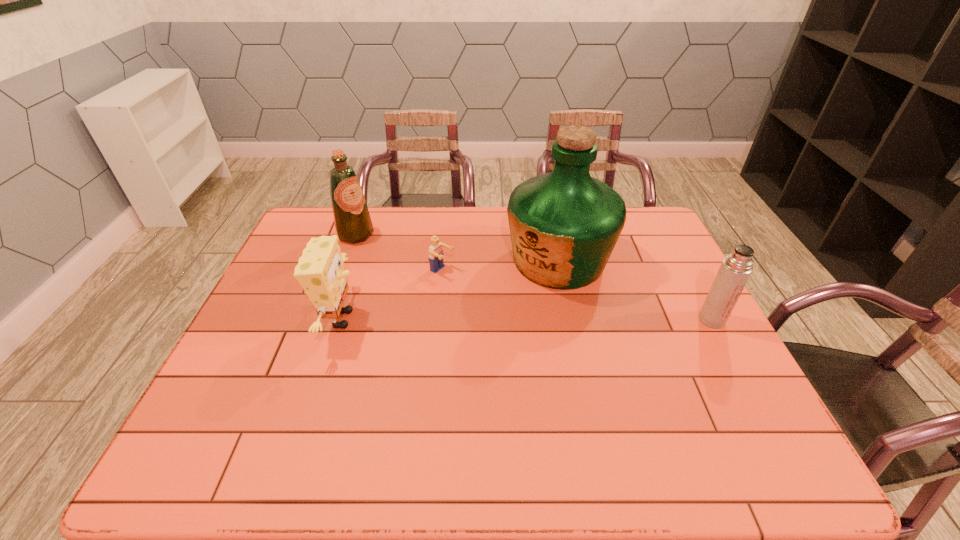
Locate an element on the screen. The image size is (960, 540). object that is at the left edge is located at coordinates (353, 224).

Image resolution: width=960 pixels, height=540 pixels. Find the location of `object at the right edge`. object at the right edge is located at coordinates (735, 270).

Where is `object that is at the far left corner`? object that is at the far left corner is located at coordinates (353, 224).

In the image, there is a desktop. Find the location of `vacant space at the far edge`. vacant space at the far edge is located at coordinates (462, 212).

Image resolution: width=960 pixels, height=540 pixels. Identify the location of vacant space at the near edge of the desktop. (606, 402).

At what (x,y) coordinates should I click in order to perform the action: click on free region at the left edge of the desktop. Please return your answer as a coordinate pair (x, y). Looking at the image, I should click on (249, 332).

Where is `blank space at the right edge of the desktop`? This screenshot has height=540, width=960. blank space at the right edge of the desktop is located at coordinates (703, 357).

Where is `free region at the near left corner`? Image resolution: width=960 pixels, height=540 pixels. free region at the near left corner is located at coordinates (226, 408).

You are a GUI agent. You are given a task and a screenshot of the screen. Output one action in this format:
    pyautogui.click(x=<x>, y=<y>)
    Task: Click on the free space between the Lego and the olive oil
    Image resolution: width=960 pixels, height=540 pixels.
    Given the screenshot: What is the action you would take?
    pyautogui.click(x=399, y=253)

At what (x,y) coordinates should I click in order to perform the action: click on vacant area that lies between the Lego and the second object from right to left. Please return your answer as a coordinate pair (x, y). The height and width of the screenshot is (540, 960). Looking at the image, I should click on (500, 266).